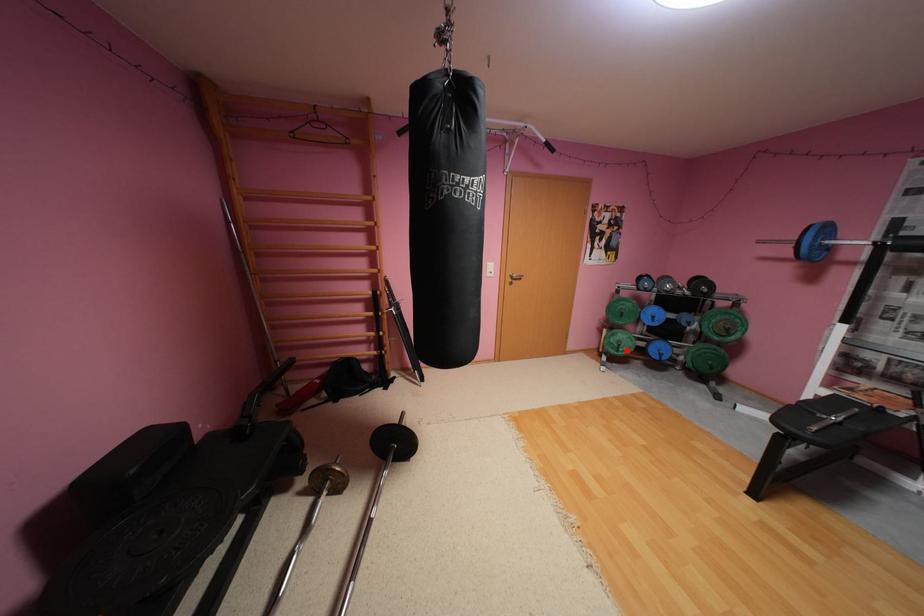
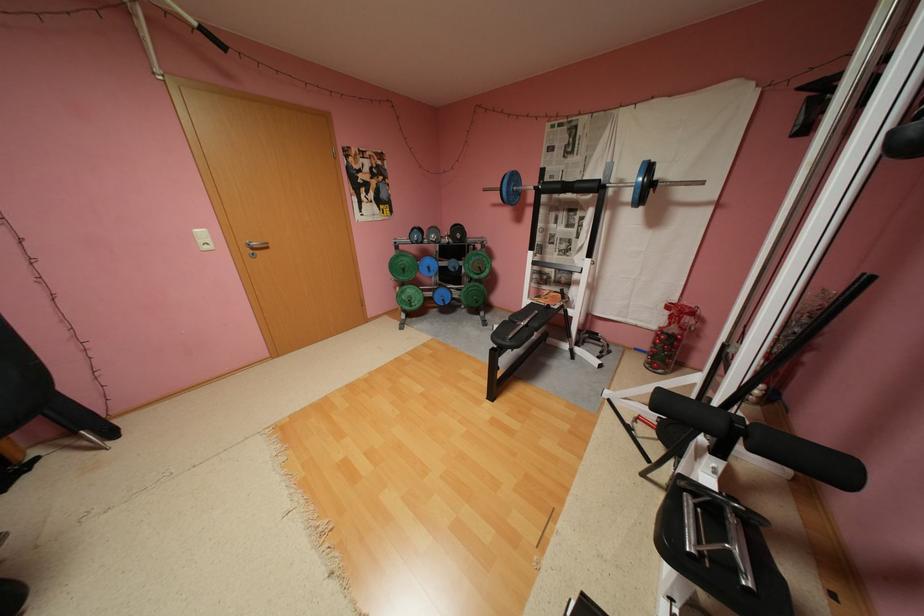
Question: I am providing you with two images of the same scene from different viewpoints. A red point is shown in image1. For the corresponding object point in image2, is it positioned nearer or farther from the camera?

Choices:
 (A) Nearer
 (B) Farther

Answer: (A)